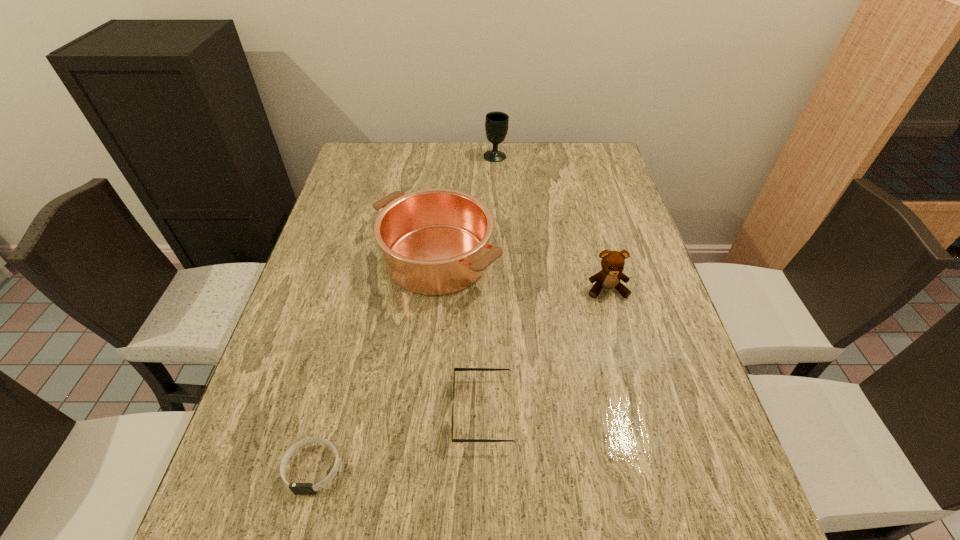
At what (x,y) coordinates should I click in order to perform the action: click on chalice. Please return your answer as a coordinate pair (x, y). The height and width of the screenshot is (540, 960). Looking at the image, I should click on (496, 123).

The height and width of the screenshot is (540, 960). I want to click on saucepan, so click(435, 241).

In order to click on the rightmost object in this screenshot , I will do `click(612, 262)`.

The width and height of the screenshot is (960, 540). Identify the location of the second shortest object. (455, 369).

The height and width of the screenshot is (540, 960). Find the location of `the shortest object`. the shortest object is located at coordinates (297, 488).

Image resolution: width=960 pixels, height=540 pixels. What are the coordinates of `blank area located on the right of the chalice` in the screenshot? It's located at (533, 156).

At what (x,y) coordinates should I click in order to perform the action: click on blank space located on the front of the saucepan. Please return your answer as a coordinate pair (x, y). This screenshot has height=540, width=960. Looking at the image, I should click on coord(423,397).

Where is `vacant space located on the front-facing side of the teddy bear`? This screenshot has width=960, height=540. vacant space located on the front-facing side of the teddy bear is located at coordinates (624, 352).

Where is `vacant space located on the front-facing side of the fourth tallest object`? vacant space located on the front-facing side of the fourth tallest object is located at coordinates (300, 411).

Where is `free space located 0.350m on the front-facing side of the fourth tallest object`? This screenshot has width=960, height=540. free space located 0.350m on the front-facing side of the fourth tallest object is located at coordinates (276, 411).